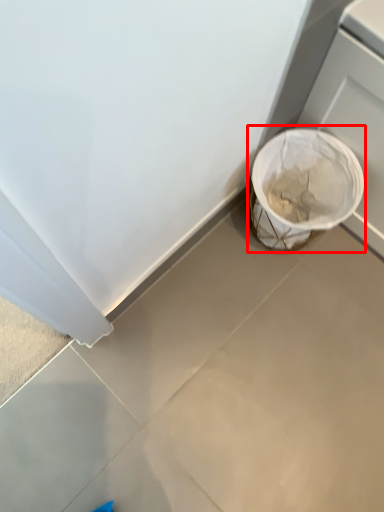
Question: From the image's perspective, where is waste container (annotated by the red box) located relative to concrete?

Choices:
 (A) above
 (B) below

Answer: (A)